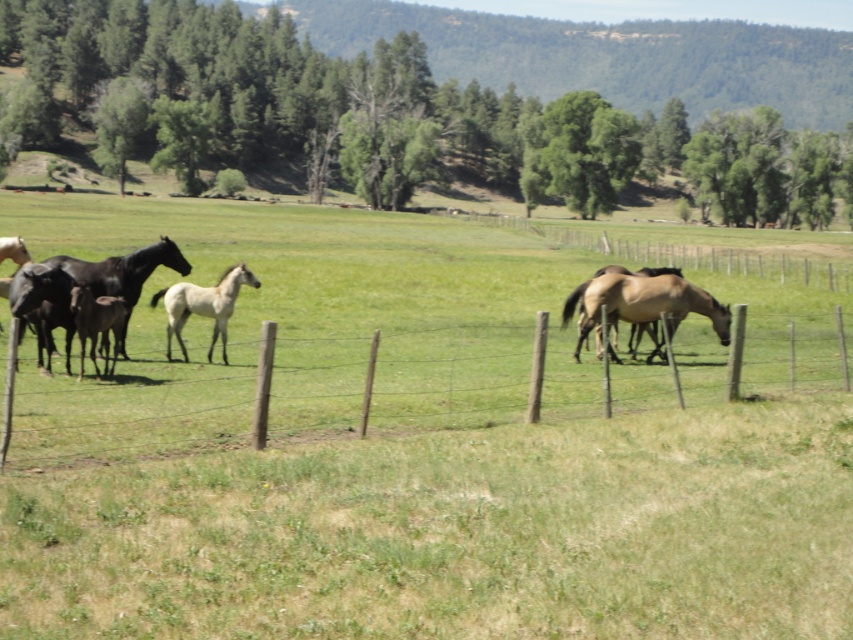
Based on the photo, you are standing at the point with coordinates point (73, 268) and want to see if you can see the point (610, 506). Based on their positions, can you see it?

Point (610, 506) is in front of point (73, 268), so yes, you can see point (610, 506) from point (73, 268) because it is closer to you.

You are standing at the fence in the foreground of the image. You want to locate the brown glossy horse at center. Which direction should you look relative to your position?

You should look towards the center of the image, where the brown glossy horse at center is located at point coordinates approximately 0.475 on the x axis and 0.755 on the y axis.